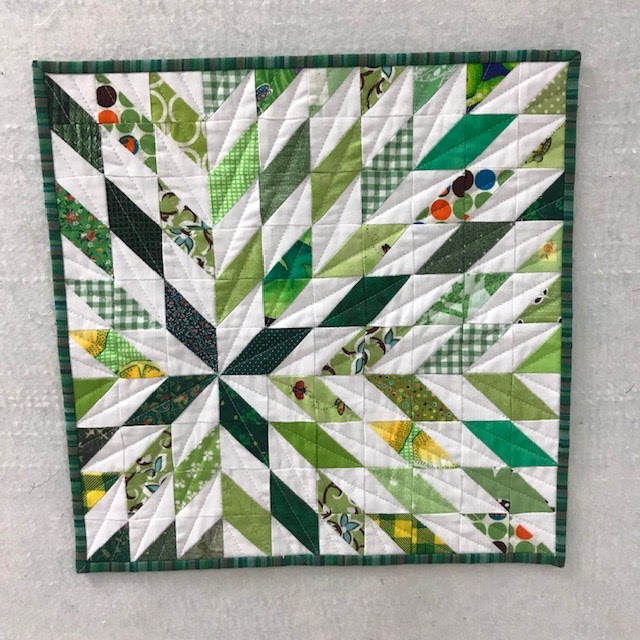
Image resolution: width=640 pixels, height=640 pixels. Find the location of `quilt border`. quilt border is located at coordinates (331, 61), (564, 301), (340, 559), (61, 308).